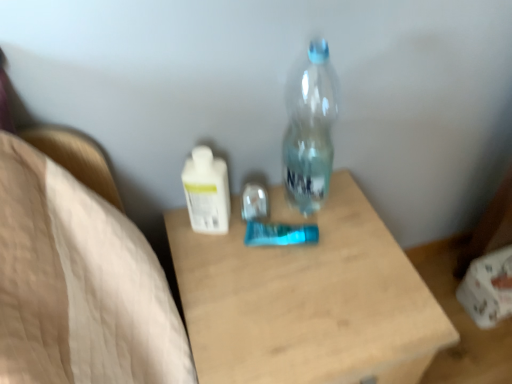
Question: Is wooden table at center smaller than white glossy lotion at center, the 1th bottle viewed from the left?

Choices:
 (A) no
 (B) yes

Answer: (A)

Question: Is wooden table at center oriented away from white glossy lotion at center, the 1th bottle viewed from the left?

Choices:
 (A) no
 (B) yes

Answer: (A)

Question: Can you confirm if wooden table at center is wider than white glossy lotion at center, the 1th bottle viewed from the left?

Choices:
 (A) no
 (B) yes

Answer: (B)

Question: Is the position of wooden table at center more distant than that of white glossy lotion at center, the 1th bottle viewed from the left?

Choices:
 (A) no
 (B) yes

Answer: (A)

Question: Considering the relative positions of wooden table at center and white glossy lotion at center, marked as the 2th bottle in a right-to-left arrangement, in the image provided, is wooden table at center to the left of white glossy lotion at center, marked as the 2th bottle in a right-to-left arrangement, from the viewer's perspective?

Choices:
 (A) no
 (B) yes

Answer: (A)

Question: From their relative heights in the image, would you say transparent plastic bottle at center, which appears as the 2th bottle when viewed from the left, is taller or shorter than white glossy lotion at center, marked as the 2th bottle in a right-to-left arrangement?

Choices:
 (A) tall
 (B) short

Answer: (A)

Question: From a real-world perspective, relative to white glossy lotion at center, the 1th bottle viewed from the left, is transparent plastic bottle at center, which appears as the first bottle when viewed from the right, vertically above or below?

Choices:
 (A) above
 (B) below

Answer: (A)

Question: Based on their sizes in the image, would you say transparent plastic bottle at center, which appears as the 2th bottle when viewed from the left, is bigger or smaller than white glossy lotion at center, marked as the 2th bottle in a right-to-left arrangement?

Choices:
 (A) small
 (B) big

Answer: (B)

Question: Visually, is transparent plastic bottle at center, which appears as the 2th bottle when viewed from the left, positioned to the left or to the right of white glossy lotion at center, marked as the 2th bottle in a right-to-left arrangement?

Choices:
 (A) left
 (B) right

Answer: (B)

Question: Based on their positions, is white glossy lotion at center, marked as the 2th bottle in a right-to-left arrangement, located to the left or right of wooden table at center?

Choices:
 (A) right
 (B) left

Answer: (B)

Question: Considering the positions of white glossy lotion at center, the 1th bottle viewed from the left, and wooden table at center in the image, is white glossy lotion at center, the 1th bottle viewed from the left, bigger or smaller than wooden table at center?

Choices:
 (A) big
 (B) small

Answer: (B)

Question: Considering their positions, is white glossy lotion at center, marked as the 2th bottle in a right-to-left arrangement, located in front of or behind wooden table at center?

Choices:
 (A) front
 (B) behind

Answer: (B)

Question: From the image's perspective, is white glossy lotion at center, the 1th bottle viewed from the left, above or below wooden table at center?

Choices:
 (A) below
 (B) above

Answer: (B)

Question: Is wooden table at center to the left or to the right of transparent plastic bottle at center, which appears as the 2th bottle when viewed from the left, in the image?

Choices:
 (A) left
 (B) right

Answer: (A)

Question: Relative to transparent plastic bottle at center, which appears as the first bottle when viewed from the right, is wooden table at center in front or behind?

Choices:
 (A) behind
 (B) front

Answer: (B)